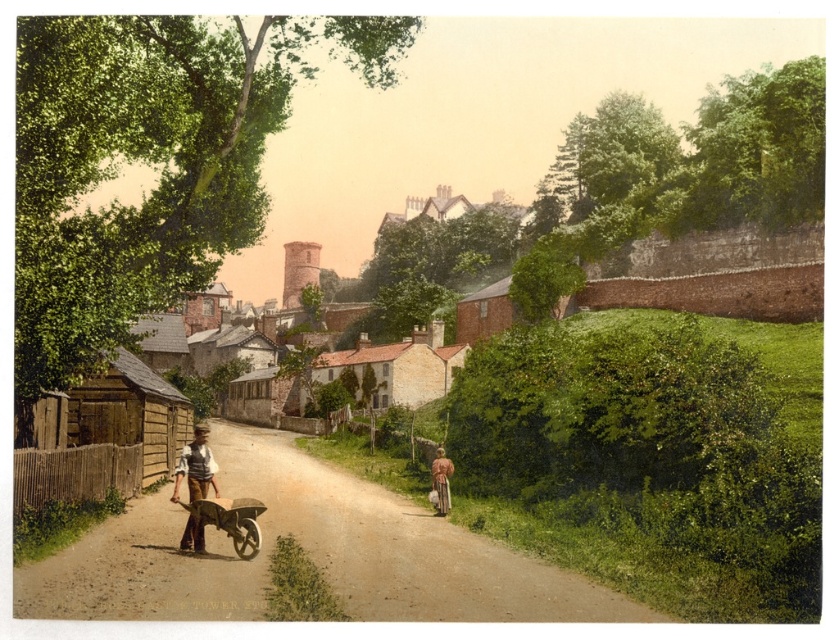
You are standing at the point labeled point [436,474] and want to walk to the point labeled point [64,566]. Given the scene described, is the path between these two points clear of any obstacles like the man with the wheelbarrow or the dirt road?

The path between point [436,474] and point [64,566] is clear because point [64,566] is in front of point [436,474], indicating it is closer to the viewer. Since the man with the wheelbarrow is on the left side of the road and the dirt road curves gently, there are no obstacles blocking the path between these two points.

You are standing at the point labeled point (185, 536) and want to walk towards the point labeled point (206, 506). Which direction should you face to move directly towards it?

You should face north to move directly towards point (206, 506) from point (185, 536).

Looking at this image, you are standing at the point with coordinates point (219, 499) and want to walk to the point with coordinates point (245, 484). Which direction should you face to walk towards your destination?

You should face north because point (245, 484) is behind point (219, 499).